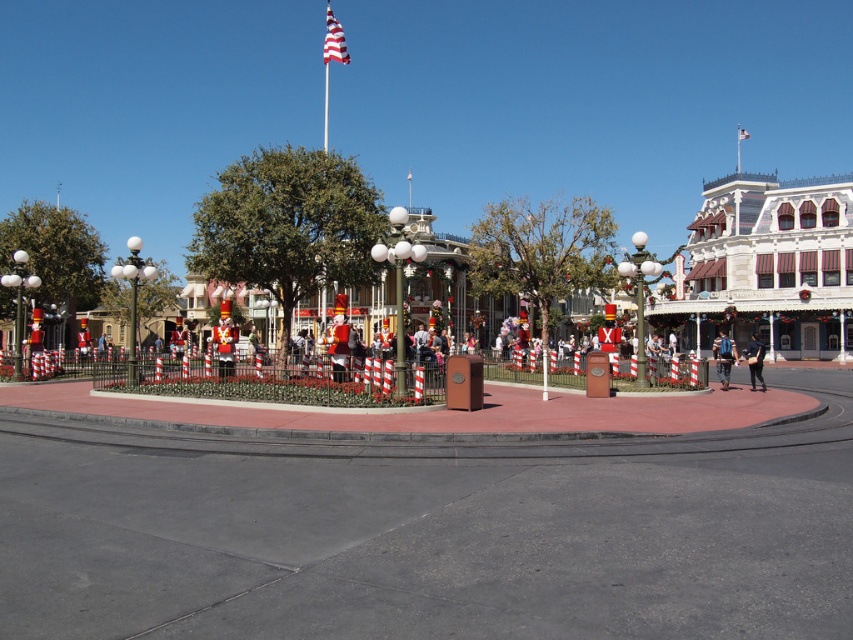
Is black leather jacket at center shorter than american flag at center?

Yes, black leather jacket at center is shorter than american flag at center.

Is black leather jacket at center closer to the viewer compared to american flag at center?

Yes, it is in front of american flag at center.

Between point (744, 356) and point (740, 131), which one is positioned in front?

Point (744, 356) is in front.

Find the location of a particular element. black leather jacket at center is located at coordinates (755, 360).

Who is positioned more to the right, american flag at upper center or metallic flag pole at upper center?

metallic flag pole at upper center is more to the right.

In order to click on american flag at upper center in this screenshot , I will do `click(334, 40)`.

This screenshot has width=853, height=640. Find the location of `american flag at upper center`. american flag at upper center is located at coordinates (334, 40).

Does american flag at upper center have a lesser width compared to black leather jacket at center?

No.

Between point (334, 56) and point (762, 387), which one is positioned behind?

Point (334, 56)

Locate an element on the screen. This screenshot has height=640, width=853. american flag at upper center is located at coordinates (334, 40).